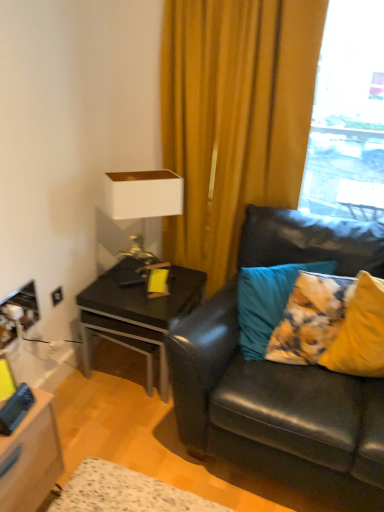
Question: Is teal fabric pillow at right, the 1th pillow in the left-to-right sequence, shorter than black leather couch at right?

Choices:
 (A) yes
 (B) no

Answer: (A)

Question: Could you tell me if teal fabric pillow at right, the 1th pillow in the left-to-right sequence, is facing black leather couch at right?

Choices:
 (A) yes
 (B) no

Answer: (A)

Question: Is teal fabric pillow at right, marked as the second pillow in a right-to-left arrangement, facing away from black leather couch at right?

Choices:
 (A) no
 (B) yes

Answer: (B)

Question: Is the depth of teal fabric pillow at right, the 1th pillow in the left-to-right sequence, greater than that of black leather couch at right?

Choices:
 (A) no
 (B) yes

Answer: (B)

Question: Considering the relative positions of teal fabric pillow at right, the 1th pillow in the left-to-right sequence, and black leather couch at right in the image provided, is teal fabric pillow at right, the 1th pillow in the left-to-right sequence, to the left of black leather couch at right from the viewer's perspective?

Choices:
 (A) yes
 (B) no

Answer: (A)

Question: Based on their sizes in the image, would you say black glossy side table at left is bigger or smaller than yellow fabric pillow at right, which is the 1th pillow from right to left?

Choices:
 (A) small
 (B) big

Answer: (B)

Question: Is black glossy side table at left inside or outside of yellow fabric pillow at right, which is the 2th pillow from left to right?

Choices:
 (A) inside
 (B) outside

Answer: (B)

Question: Is point (114, 313) closer or farther from the camera than point (357, 288)?

Choices:
 (A) closer
 (B) farther

Answer: (B)

Question: Looking at their shapes, would you say black glossy side table at left is wider or thinner than yellow fabric pillow at right, which is the 2th pillow from left to right?

Choices:
 (A) thin
 (B) wide

Answer: (B)

Question: Does point (112, 215) appear closer or farther from the camera than point (360, 274)?

Choices:
 (A) closer
 (B) farther

Answer: (B)

Question: From a real-world perspective, is white matte table lamp at upper left positioned above or below yellow fabric pillow at right, which is the 2th pillow from left to right?

Choices:
 (A) below
 (B) above

Answer: (B)

Question: From their relative heights in the image, would you say white matte table lamp at upper left is taller or shorter than yellow fabric pillow at right, which is the 2th pillow from left to right?

Choices:
 (A) short
 (B) tall

Answer: (B)

Question: In the image, is white matte table lamp at upper left positioned in front of or behind yellow fabric pillow at right, which is the 1th pillow from right to left?

Choices:
 (A) behind
 (B) front

Answer: (A)

Question: Is black leather couch at right taller or shorter than black glossy side table at left?

Choices:
 (A) tall
 (B) short

Answer: (A)

Question: From a real-world perspective, is black leather couch at right physically located above or below black glossy side table at left?

Choices:
 (A) above
 (B) below

Answer: (A)